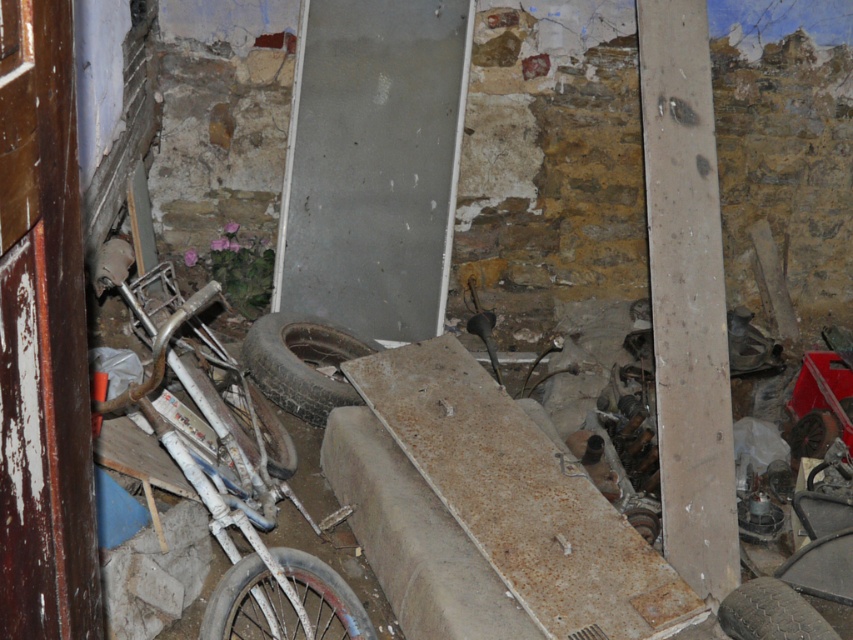
Question: Observing the image, what is the correct spatial positioning of black rubber tire at center in reference to rusty metal tire at center?

Choices:
 (A) above
 (B) below

Answer: (A)

Question: Can you confirm if blue rubber tire at lower left is positioned below rubber tread tire at center?

Choices:
 (A) no
 (B) yes

Answer: (A)

Question: Which object is positioned closest to the rubber tread tire at center?

Choices:
 (A) blue rubber tire at lower left
 (B) black rubber tire at center

Answer: (A)

Question: Which is nearer to the rusty metal tire at center?

Choices:
 (A) blue rubber tire at lower left
 (B) black rubber tire at center
 (C) rubber tread tire at center

Answer: (B)

Question: Where is rusty metal bicycle at lower left located in relation to rusty metal tire at center in the image?

Choices:
 (A) right
 (B) left

Answer: (B)

Question: Which object is positioned farthest from the rubber tread tire at center?

Choices:
 (A) rusty metal tire at center
 (B) black rubber tire at center

Answer: (B)